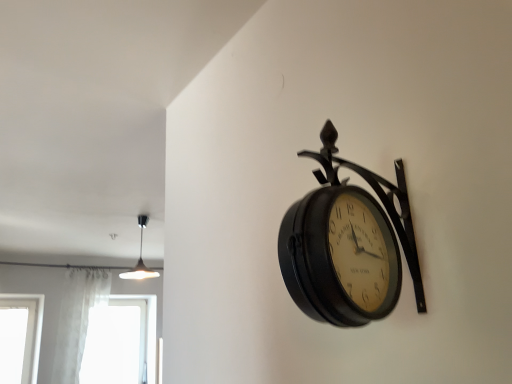
Question: Is white sheer curtain at lower left wider or thinner than matte black pendant light at upper left?

Choices:
 (A) wide
 (B) thin

Answer: (B)

Question: Based on their sizes in the image, would you say white sheer curtain at lower left is bigger or smaller than matte black pendant light at upper left?

Choices:
 (A) small
 (B) big

Answer: (B)

Question: Which of these objects is positioned farthest from the transparent glass window at lower left?

Choices:
 (A) white sheer curtain at lower left
 (B) matte black clock at upper right
 (C) matte black pendant light at upper left

Answer: (B)

Question: Considering the real-world distances, which object is farthest from the transparent glass window at lower left?

Choices:
 (A) matte black pendant light at upper left
 (B) white sheer curtain at lower left
 (C) matte black clock at upper right

Answer: (C)